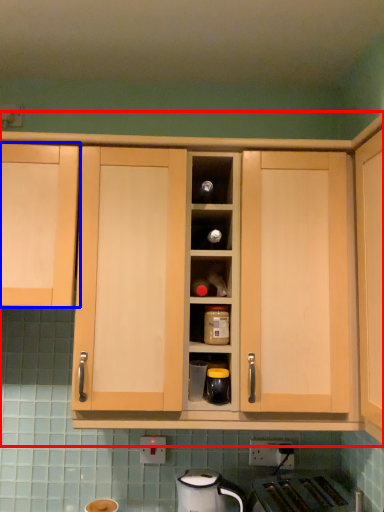
Question: Which point is further to the camera, cabinetry (highlighted by a red box) or cabinetry (highlighted by a blue box)?

Choices:
 (A) cabinetry
 (B) cabinetry

Answer: (B)